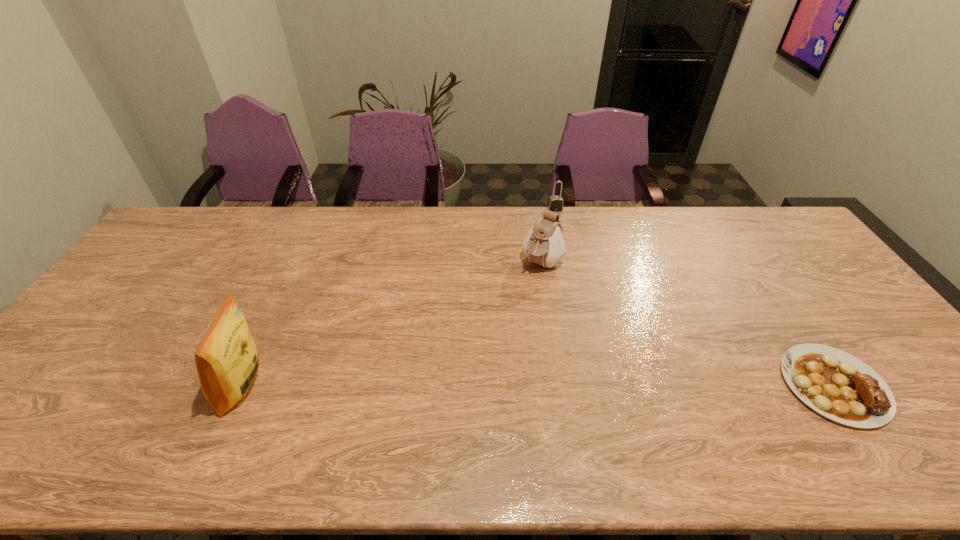
Find the location of a particular element. Image resolution: width=960 pixels, height=540 pixels. blank region between the tallest object and the steak is located at coordinates (539, 386).

This screenshot has width=960, height=540. I want to click on blank region between the shortest object and the farthest object, so click(694, 297).

Identify the location of unoccupied position between the leftmost object and the pouch. (393, 325).

In order to click on free space between the shortest object and the leftmost object in this screenshot , I will do `click(539, 386)`.

Find the location of a particular element. The height and width of the screenshot is (540, 960). vacant area between the shortest object and the second tallest object is located at coordinates (687, 324).

Find the location of `free area in between the crisp (potato chip) and the third shortest object`. free area in between the crisp (potato chip) and the third shortest object is located at coordinates (393, 325).

Where is `empty location between the shortest object and the leftmost object`? empty location between the shortest object and the leftmost object is located at coordinates (539, 386).

Identify which object is located as the second nearest to the steak. Please provide its 2D coordinates. Your answer should be formatted as a tuple, i.e. [(x, y)], where the tuple contains the x and y coordinates of a point satisfying the conditions above.

[(555, 203)]

Select which object appears as the second closest to the tallest object. Please provide its 2D coordinates. Your answer should be formatted as a tuple, i.e. [(x, y)], where the tuple contains the x and y coordinates of a point satisfying the conditions above.

[(555, 203)]